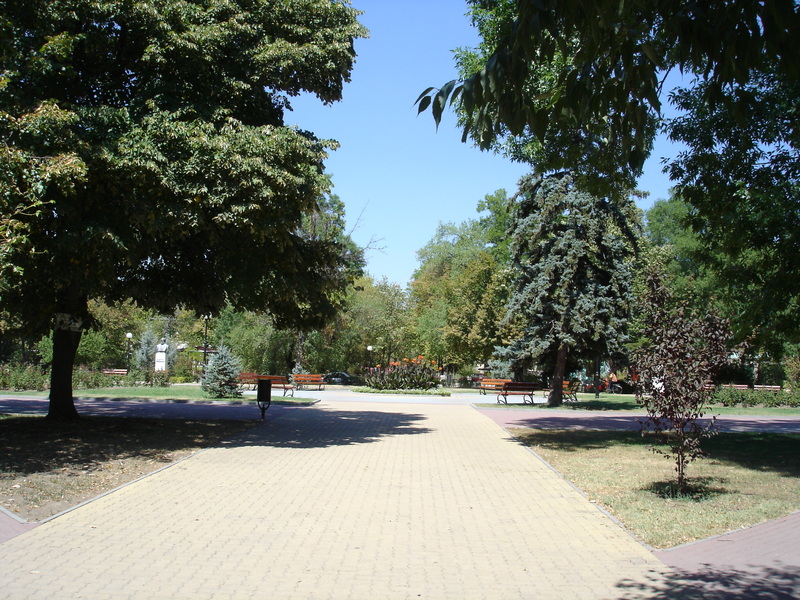
Identify the location of waste receptacle. Image resolution: width=800 pixels, height=600 pixels. (264, 388).